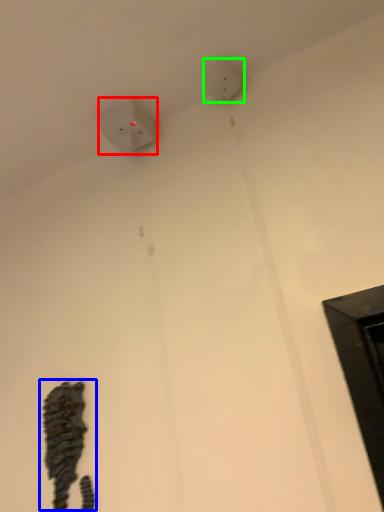
Question: Considering the real-world distances, which object is farthest from power plugs and sockets (highlighted by a red box)? animal (highlighted by a blue box) or electric outlet (highlighted by a green box)?

Choices:
 (A) animal
 (B) electric outlet

Answer: (A)